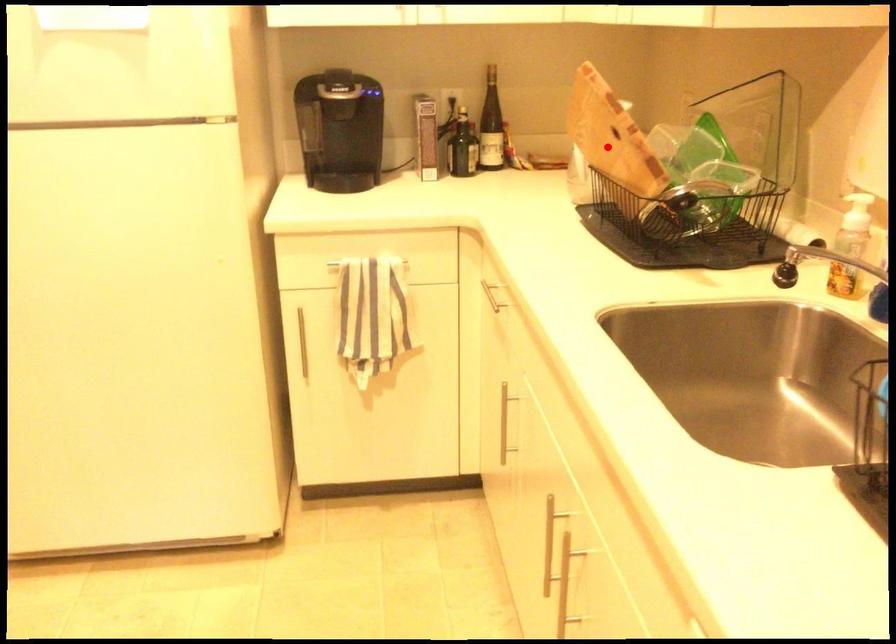
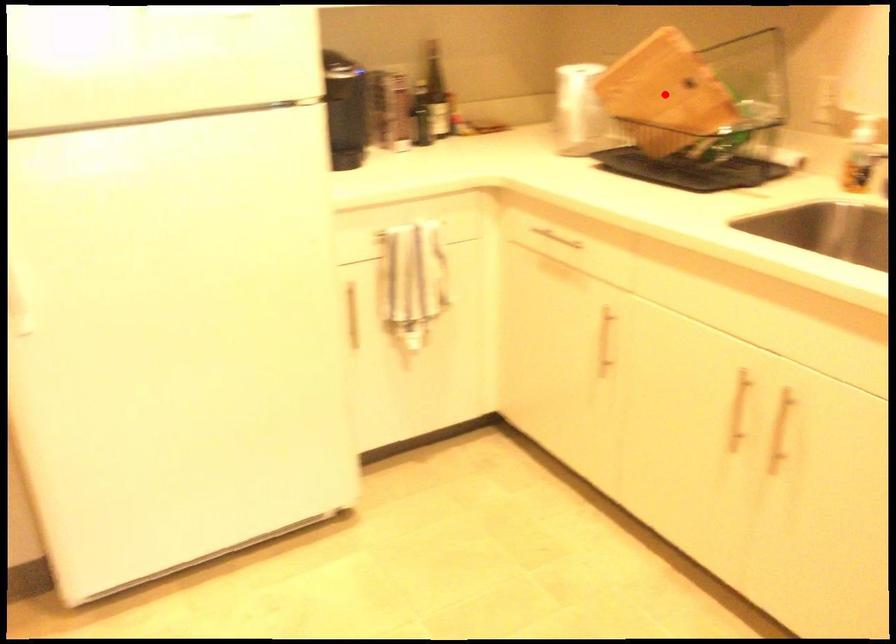
I am providing you with two images of the same scene from different viewpoints. A red point is marked on the first image and another point is marked on the second image. Is the red point in image1 aligned with the point shown in image2?

Yes